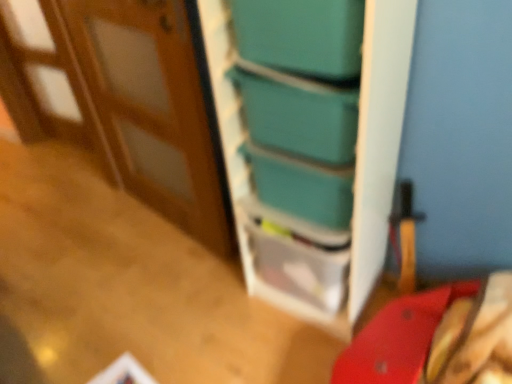
Find the location of a particular element. Image resolution: width=512 pixels, height=384 pixels. vacant space that is to the left of teal plastic bookshelf at center is located at coordinates (224, 318).